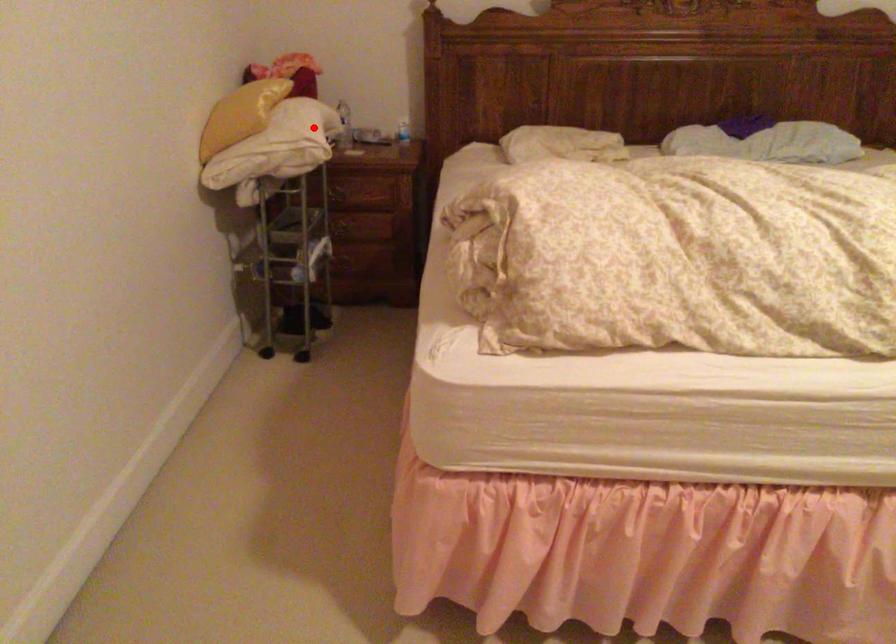
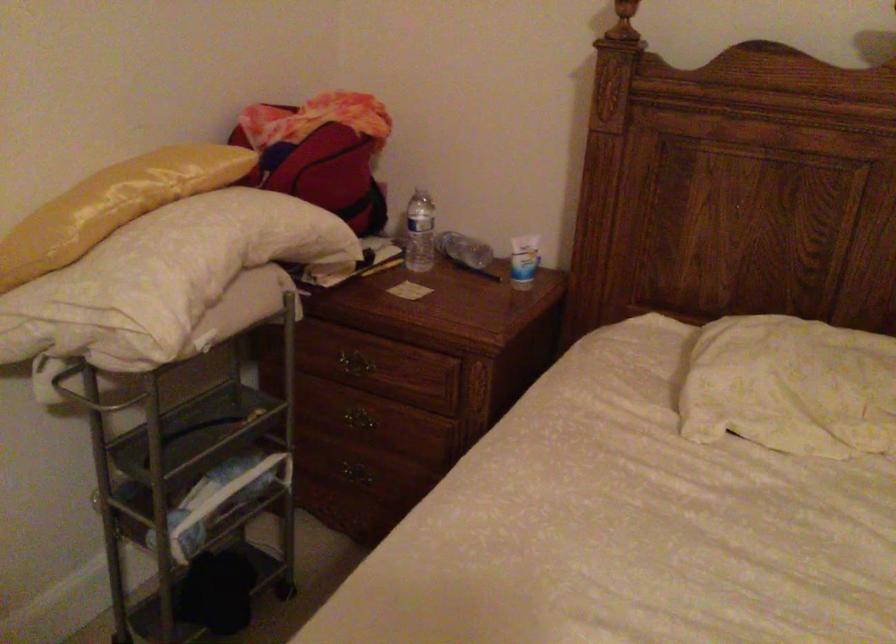
Where in the second image is the point corresponding to the highlighted location from the first image?

(164, 278)